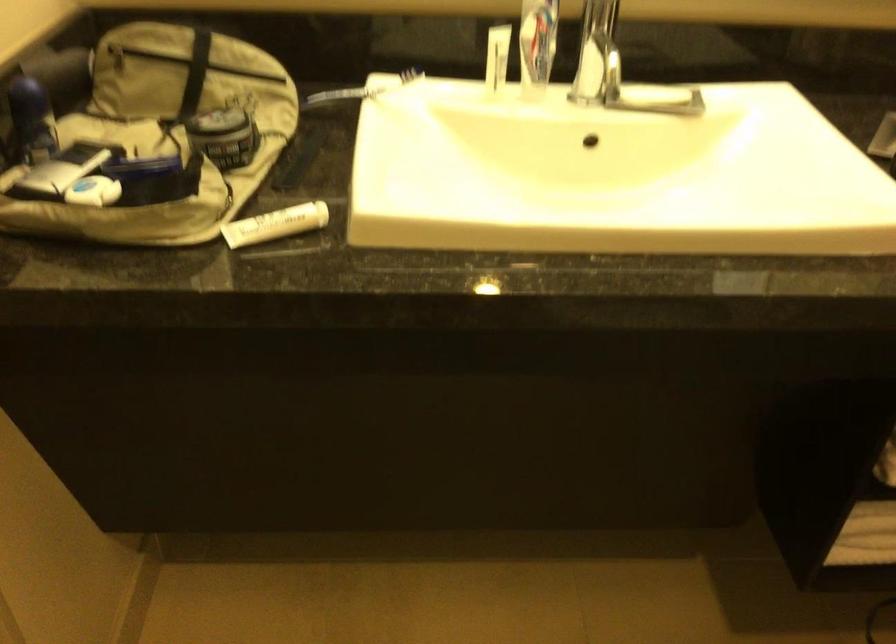
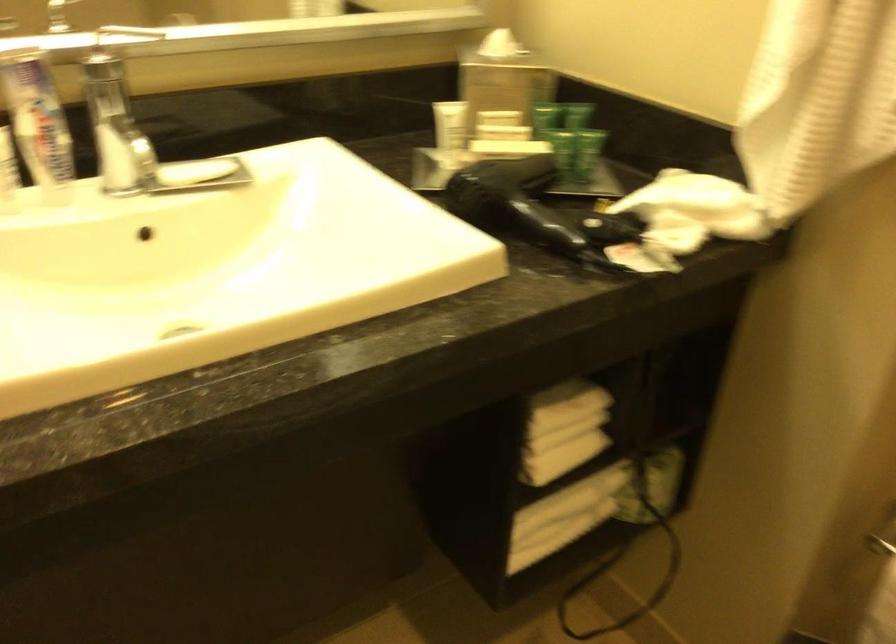
In the second image, find the point that corresponds to point (645, 89) in the first image.

(195, 171)